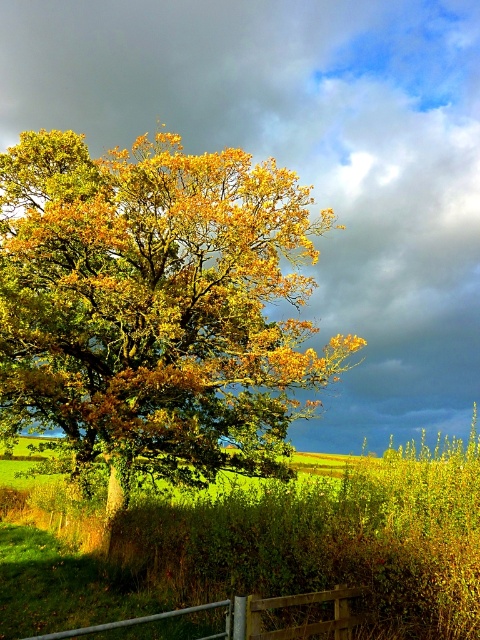
From the picture: You are a painter setting up your easel in the middle of the grassy area. You want to paint both the golden yellow leaves at center and the metallic silver gate at lower center in your artwork. Which object should you focus on first to ensure it appears larger in your painting?

The golden yellow leaves at center should be focused on first because they have a greater height compared to the metallic silver gate at lower center, making them naturally appear larger in the painting.

You are a bird flying over the rural landscape. You spot the golden yellow leaves at center. Can you estimate their location in terms of coordinates?

The golden yellow leaves at center are located at coordinates point (156, 307).